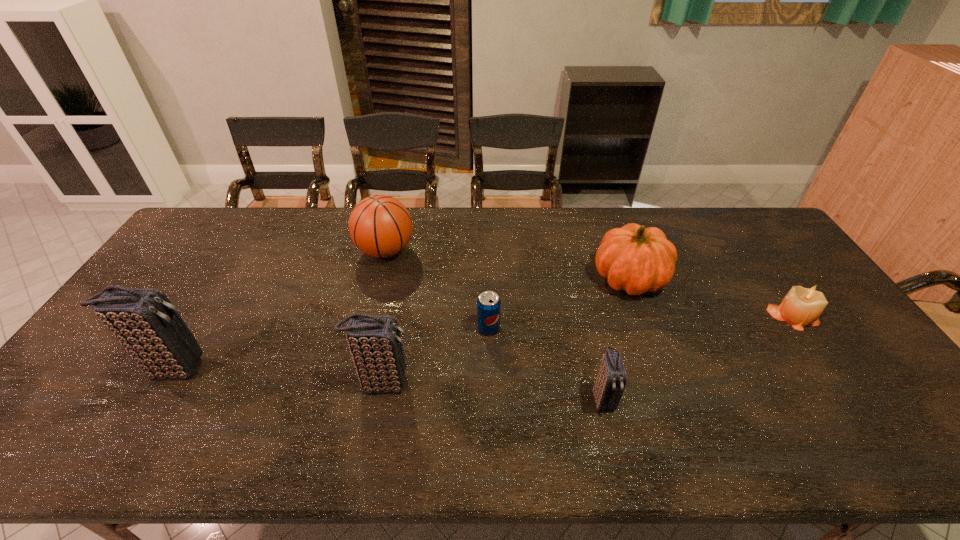
The height and width of the screenshot is (540, 960). Find the location of `free spot located on the front of the basketball`. free spot located on the front of the basketball is located at coordinates (368, 323).

Identify the location of vacant point located 0.170m on the front of the second object from right to left. (656, 351).

Find the location of `vacant space located on the left of the rightmost object`. vacant space located on the left of the rightmost object is located at coordinates (683, 315).

Locate an element on the screen. This screenshot has width=960, height=540. free spot located 0.160m on the right of the pop soda is located at coordinates (557, 328).

Locate an element on the screen. object present at the far edge is located at coordinates (380, 226).

Where is `object that is at the left edge`? This screenshot has height=540, width=960. object that is at the left edge is located at coordinates (145, 322).

Locate an element on the screen. This screenshot has height=540, width=960. object at the right edge is located at coordinates (801, 307).

Find the location of a particular element. vacant space at the far edge of the desktop is located at coordinates (526, 237).

Locate an element on the screen. The height and width of the screenshot is (540, 960). vacant space at the left edge is located at coordinates [x=102, y=366].

You are a GUI agent. You are given a task and a screenshot of the screen. Output one action in this format:
    pyautogui.click(x=<x>, y=<y>)
    Task: Click on the vacant space at the far left corner of the desktop
    This screenshot has width=960, height=540.
    Given the screenshot: What is the action you would take?
    [x=195, y=234]